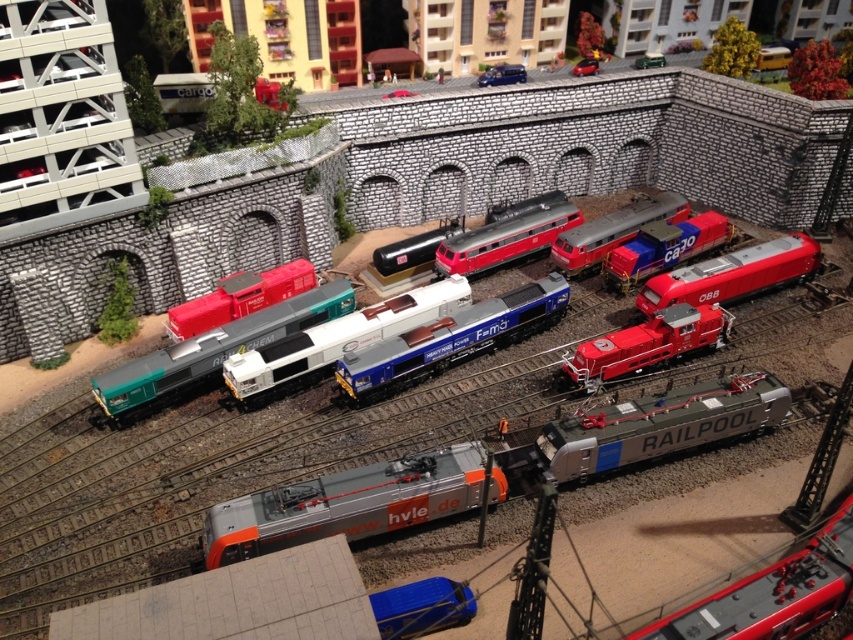
Does silver metallic locomotive at center lie in front of blue metallic locomotive at center?

That is True.

Can you confirm if silver metallic locomotive at center is taller than blue metallic locomotive at center?

Incorrect, silver metallic locomotive at center's height is not larger of blue metallic locomotive at center's.

Measure the distance between point (263,502) and camera.

Point (263,502) is 34.46 feet from camera.

Where is `silver metallic locomotive at center`? This screenshot has width=853, height=640. silver metallic locomotive at center is located at coordinates [x=346, y=502].

Is point (468, 344) positioned behind point (722, 268)?

That is False.

Can you confirm if blue metallic locomotive at center is positioned below matte red train at center?

Yes, blue metallic locomotive at center is below matte red train at center.

Which is in front, point (479, 332) or point (664, 282)?

Point (479, 332) is in front.

The image size is (853, 640). What are the coordinates of `blue metallic locomotive at center` in the screenshot? It's located at (451, 337).

Does point (364, 502) come closer to viewer compared to point (573, 355)?

Yes, point (364, 502) is closer to viewer.

Can you confirm if silver metallic locomotive at center is positioned to the right of matte red locomotive at center?

Correct, you'll find silver metallic locomotive at center to the right of matte red locomotive at center.

Is point (556, 481) less distant than point (624, 355)?

Yes, point (556, 481) is in front of point (624, 355).

I want to click on silver metallic locomotive at center, so click(x=346, y=502).